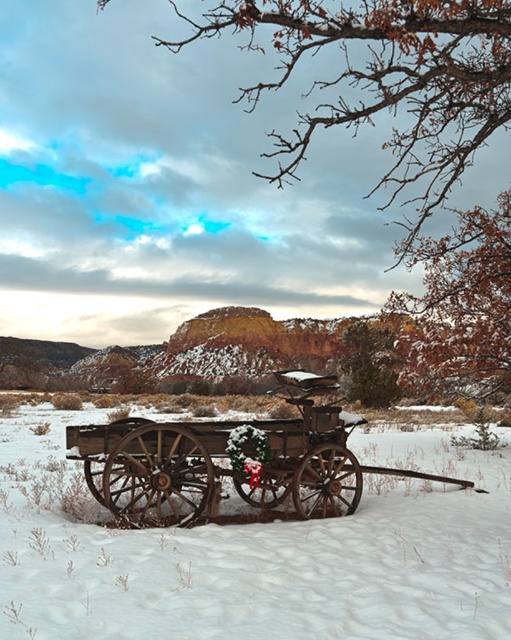
Can you confirm if wooden wagon at center is taller than rustic wood cart at center?

No, wooden wagon at center is not taller than rustic wood cart at center.

Is wooden wagon at center to the right of rustic wood cart at center from the viewer's perspective?

Incorrect, wooden wagon at center is not on the right side of rustic wood cart at center.

Identify the location of wooden wagon at center. This screenshot has width=511, height=640. (258, 554).

The height and width of the screenshot is (640, 511). In order to click on wooden wagon at center in this screenshot , I will do `click(258, 554)`.